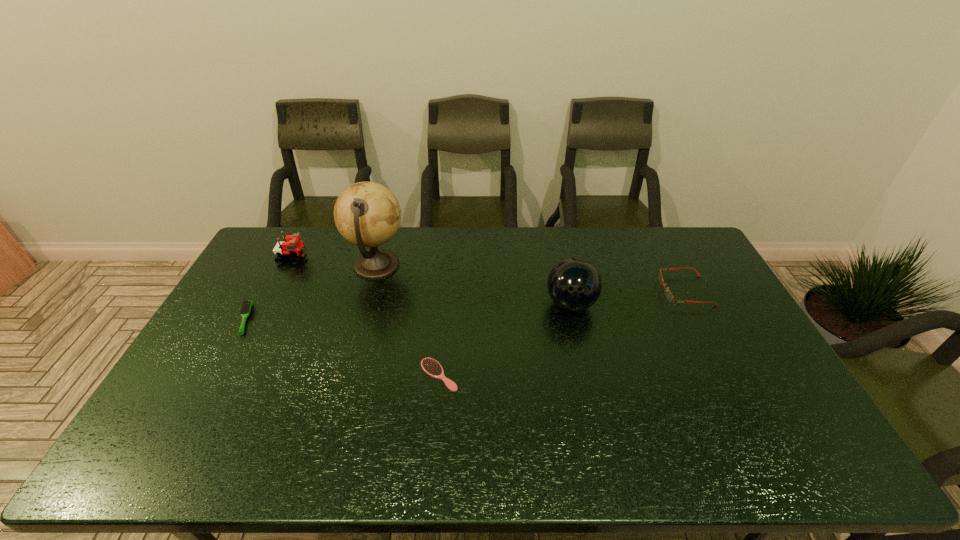
Identify which object is the closest to the spectacles. Please provide its 2D coordinates. Your answer should be formatted as a tuple, i.e. [(x, y)], where the tuple contains the x and y coordinates of a point satisfying the conditions above.

[(574, 285)]

Select which object appears as the fourth closest to the shortest object. Please provide its 2D coordinates. Your answer should be formatted as a tuple, i.e. [(x, y)], where the tuple contains the x and y coordinates of a point satisfying the conditions above.

[(292, 247)]

Locate an element on the screen. vacant position in the image that satisfies the following two spatial constraints: 1. on the front-facing side of the right hairbrush; 2. on the right side of the Lego is located at coordinates (233, 375).

Locate an element on the screen. This screenshot has width=960, height=540. free region that satisfies the following two spatial constraints: 1. on the lenses of the spectacles; 2. on the side of the second tallest object with the finger holes is located at coordinates 692,305.

The image size is (960, 540). I want to click on vacant space that satisfies the following two spatial constraints: 1. on the front-facing side of the globe; 2. on the front side of the taller hairbrush, so click(x=362, y=319).

Image resolution: width=960 pixels, height=540 pixels. Identify the location of vacant region that satisfies the following two spatial constraints: 1. on the back side of the nearest object; 2. on the front-facing side of the third tallest object. (449, 258).